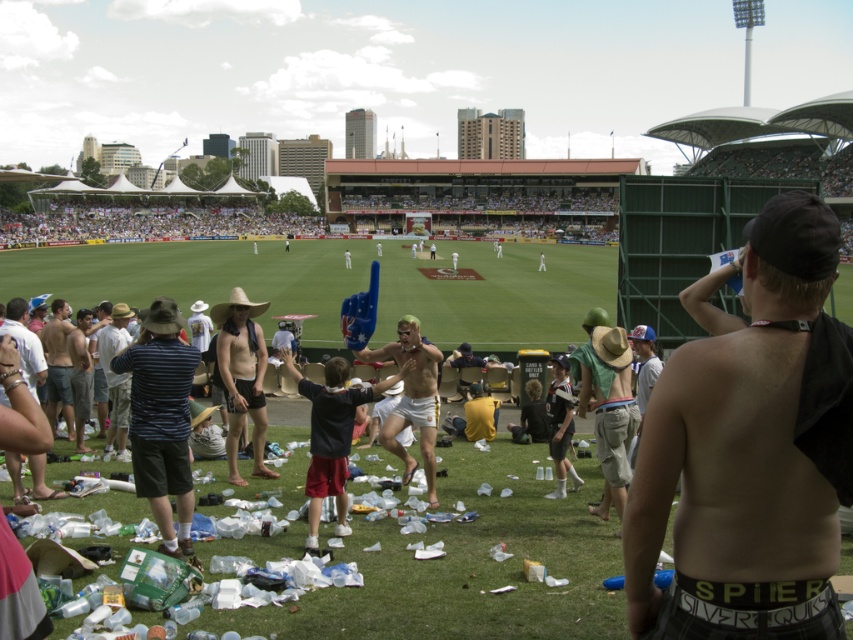
Question: From the image, what is the correct spatial relationship of shiny black tank top at right in relation to shiny white shorts at center?

Choices:
 (A) right
 (B) left

Answer: (A)

Question: Which point is closer to the camera taking this photo?

Choices:
 (A) (146, 326)
 (B) (57, 381)

Answer: (A)

Question: Which object is farther from the camera taking this photo?

Choices:
 (A) matte straw hat at center
 (B) striped shirt at center

Answer: (B)

Question: Is striped fabric shirt at left to the left of green straw hat at right from the viewer's perspective?

Choices:
 (A) yes
 (B) no

Answer: (A)

Question: Which object is the farthest from the shiny metallic shorts at lower left?

Choices:
 (A) green grass at center
 (B) shiny black tank top at right
 (C) striped fabric shirt at left

Answer: (A)

Question: Is the position of green grass at center more distant than that of shiny metallic shorts at lower left?

Choices:
 (A) yes
 (B) no

Answer: (A)